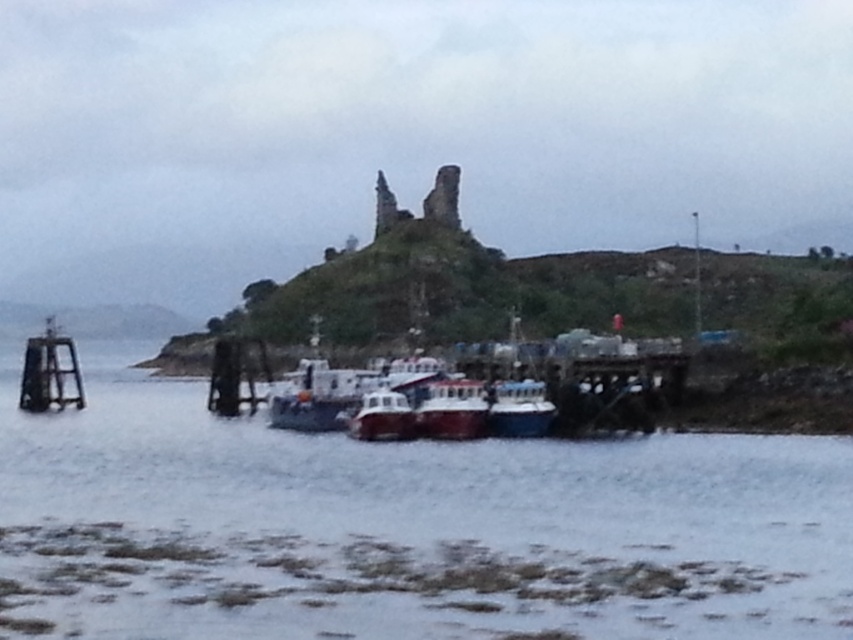
Question: Does clear water at center appear on the right side of white matte boat at center?

Choices:
 (A) yes
 (B) no

Answer: (A)

Question: Estimate the real-world distances between objects in this image. Which object is farther from the red glossy boat at center?

Choices:
 (A) white glossy boat at center
 (B) white matte boat at center

Answer: (B)

Question: Is white matte boat at center to the right of blue glossy boat at center from the viewer's perspective?

Choices:
 (A) no
 (B) yes

Answer: (A)

Question: Which of the following is the closest to the observer?

Choices:
 (A) (338, 388)
 (B) (383, 412)
 (C) (167, 561)

Answer: (C)

Question: Which point is farther to the camera?

Choices:
 (A) (462, 432)
 (B) (711, 452)
 (C) (407, 424)

Answer: (C)

Question: Can you confirm if blue glossy boat at center is wider than white glossy boat at center?

Choices:
 (A) no
 (B) yes

Answer: (B)